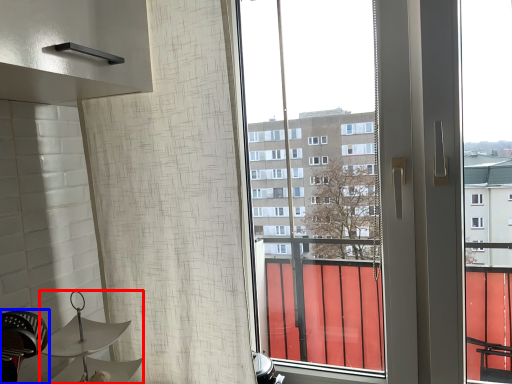
Question: Which object appears farthest to the camera in this image, lamp (highlighted by a red box) or swivel chair (highlighted by a blue box)?

Choices:
 (A) lamp
 (B) swivel chair

Answer: (A)